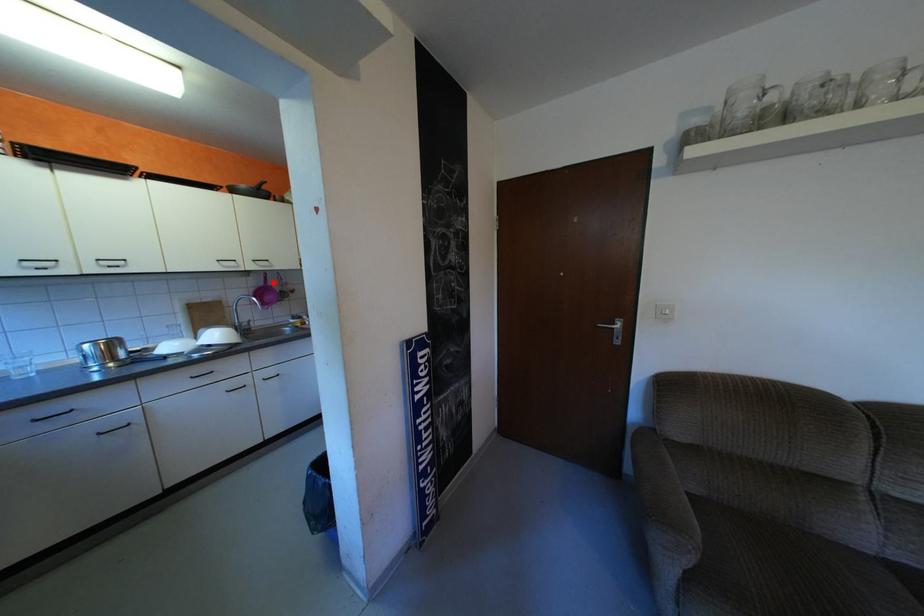
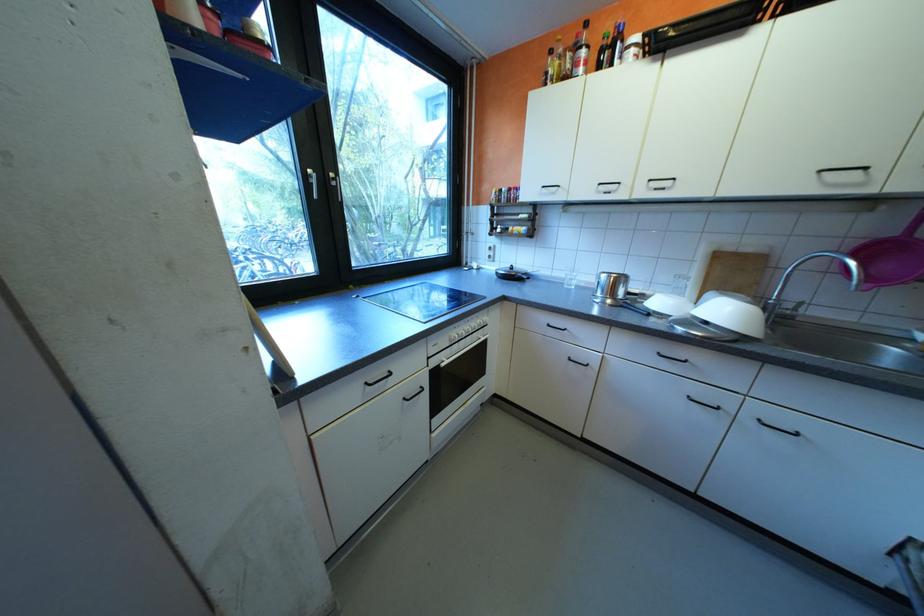
Question: I am providing you with two images of the same scene from different viewpoints. A red point is marked on the first image. Can you still see the location of the red point in image 2?

Choices:
 (A) Yes
 (B) No

Answer: (A)